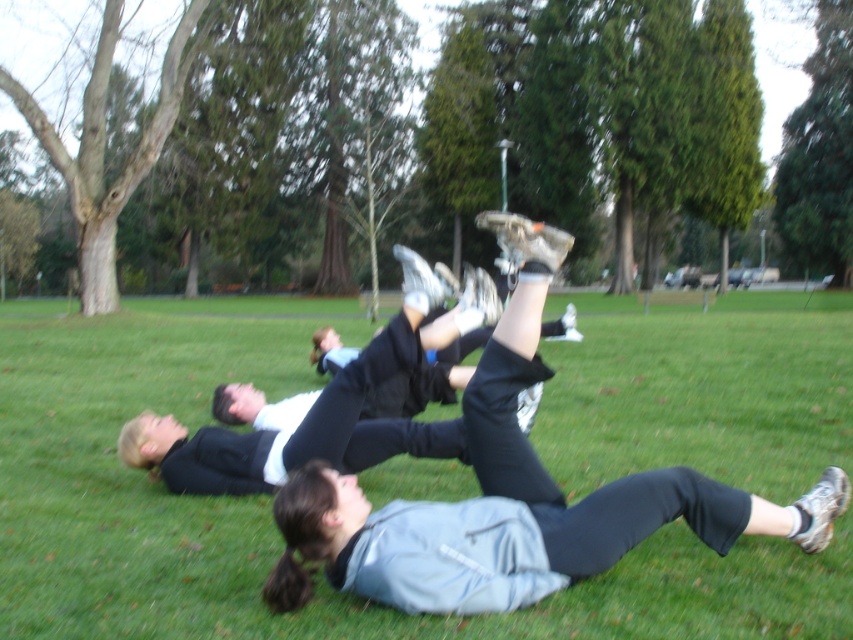
You are standing at the origin point in the park and see two points marked on the field. Which point is farther from you? The points are labeled as point (619, 342) and point (132, 460).

Point (619, 342) is behind point (132, 460), so it is farther from you.

You are a photographer standing at the edge of the grassy field. You want to take a photo of the green grass at center and the black matte pants at center. Based on their positions, which object is closer to you?

The green grass at center is positioned over the black matte pants at center, so the green grass at center is closer to you.

You are a photographer trying to capture a closeup of the green grass at center while also including the black matte pants at center in the frame. Based on their sizes, do you think you can fit both into the shot without zooming out?

The green grass at center might be wider than black matte pants at center, so there is a possibility that both can fit into the shot without needing to zoom out. However, the exact arrangement depends on their actual widths and positioning.